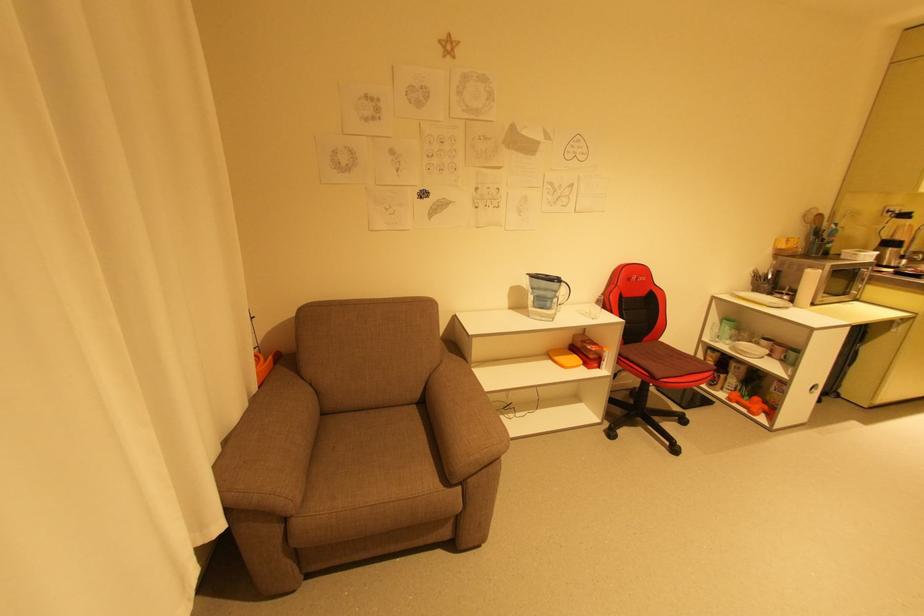
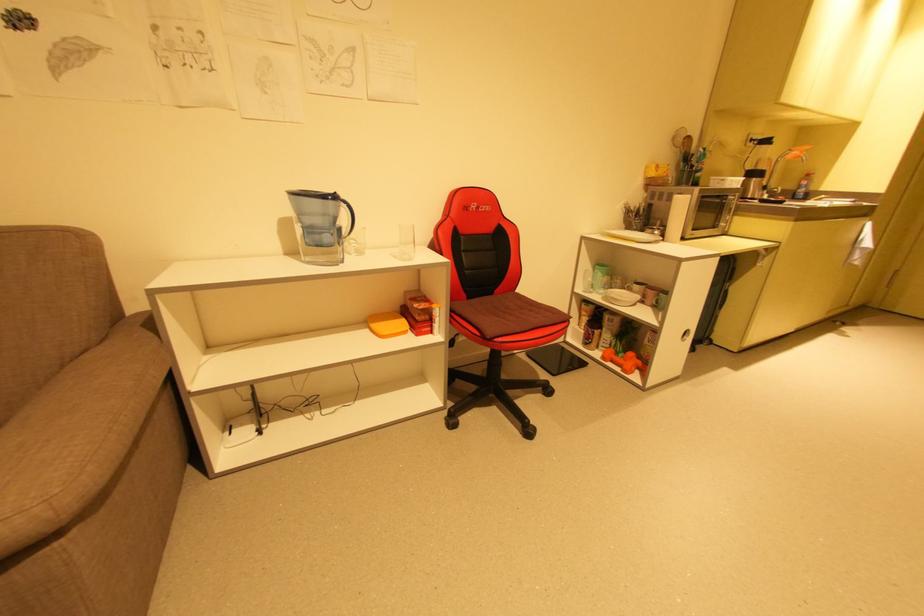
The point at (567, 284) is marked in the first image. Where is the corresponding point in the second image?

(346, 204)